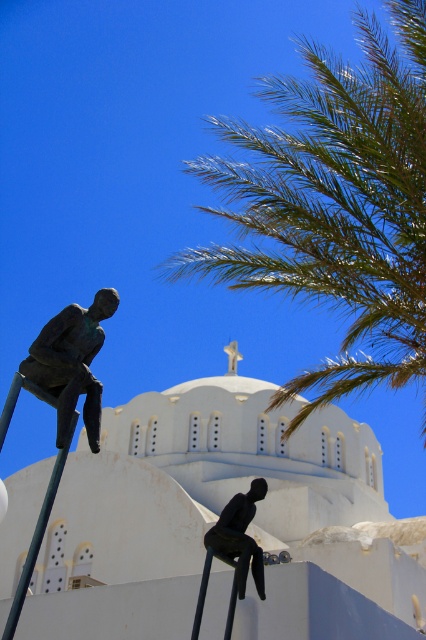
Is white smooth church at center taller than bronze statue at left?

Yes.

Between white smooth church at center and bronze statue at left, which one appears on the left side from the viewer's perspective?

bronze statue at left is more to the left.

Identify the location of white smooth church at center. (216, 518).

Does bronze statue at left have a greater width compared to green metallic pole at lower left?

No.

Is point (68, 348) positioned after point (16, 605)?

Yes.

Does point (117, 298) lie behind point (49, 508)?

That is True.

Locate an element on the screen. bronze statue at left is located at coordinates (71, 362).

Does point (3, 520) lie in front of point (54, 484)?

No.

Can you confirm if white smooth church at center is bigger than green metallic pole at lower left?

Yes.

Does point (123, 592) come closer to viewer compared to point (49, 483)?

No.

What are the coordinates of `white smooth church at center` in the screenshot? It's located at (x=216, y=518).